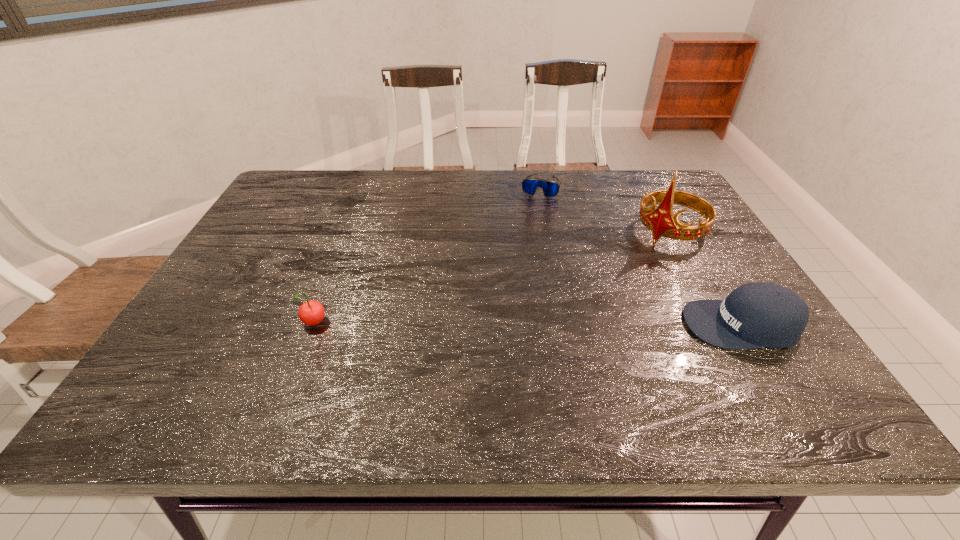
Find the location of `the leftmost object`. the leftmost object is located at coordinates (312, 312).

You are a GUI agent. You are given a task and a screenshot of the screen. Output one action in this format:
    pyautogui.click(x=<x>, y=<y>)
    Task: Click on the third tallest object
    
    Given the screenshot: What is the action you would take?
    pyautogui.click(x=756, y=315)

Identify the location of the shortest object. This screenshot has width=960, height=540. (550, 188).

Identify the location of the second object from left to right. Image resolution: width=960 pixels, height=540 pixels. (550, 188).

Identify the location of the tallest object. This screenshot has width=960, height=540. (661, 221).

This screenshot has width=960, height=540. I want to click on the second farthest object, so click(661, 221).

This screenshot has height=540, width=960. Find the location of `free spot located 0.080m on the left of the leftmost object`. free spot located 0.080m on the left of the leftmost object is located at coordinates (265, 325).

Locate an element on the screen. The height and width of the screenshot is (540, 960). free space located 0.280m on the front-facing side of the baseball cap is located at coordinates (556, 325).

I want to click on vacant area situated 0.310m on the front-facing side of the baseball cap, so click(x=542, y=325).

This screenshot has width=960, height=540. Find the location of `vacant region located on the front-facing side of the baseball cap`. vacant region located on the front-facing side of the baseball cap is located at coordinates (615, 325).